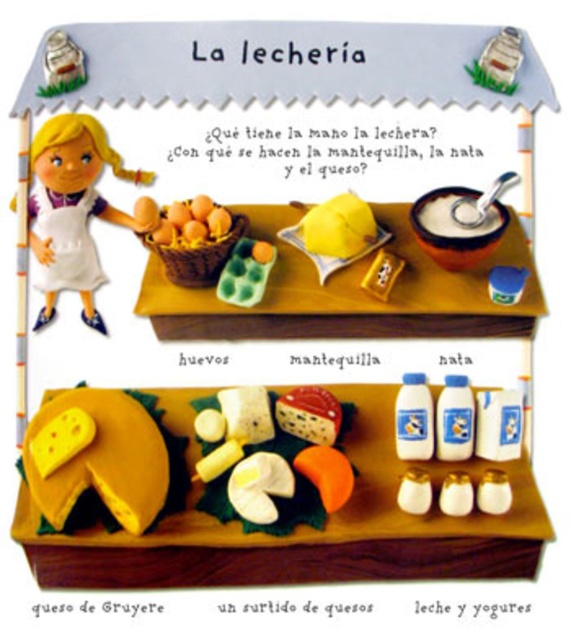
You are a customer at La lecheria and want to buy eggs. The shopkeeper points to the location of the eggs using a coordinate system where the bottom left corner is the origin. The eggs are located at point (x=191, y=221). Where should you look to find the eggs?

The eggs are located at point (x=191, y=221), which is the center of the image according to the shopkeeper.

You are a customer at La lecheria and want to buy both the yellow matte lemon at center and the white crumbly cheese at center. The store has a special offer where if one item is bigger than the other, you get the smaller one for free. Which item would you get for free?

The white crumbly cheese at center would be free because the yellow matte lemon at center is larger in size, making the cheese the smaller item.

You are a customer at La lecheria and you want to place an order. You see two points on the counter. Which point is closer to you, point (194, 237) or point (235, 260)?

Point (194, 237) is closer to you than point (235, 260).